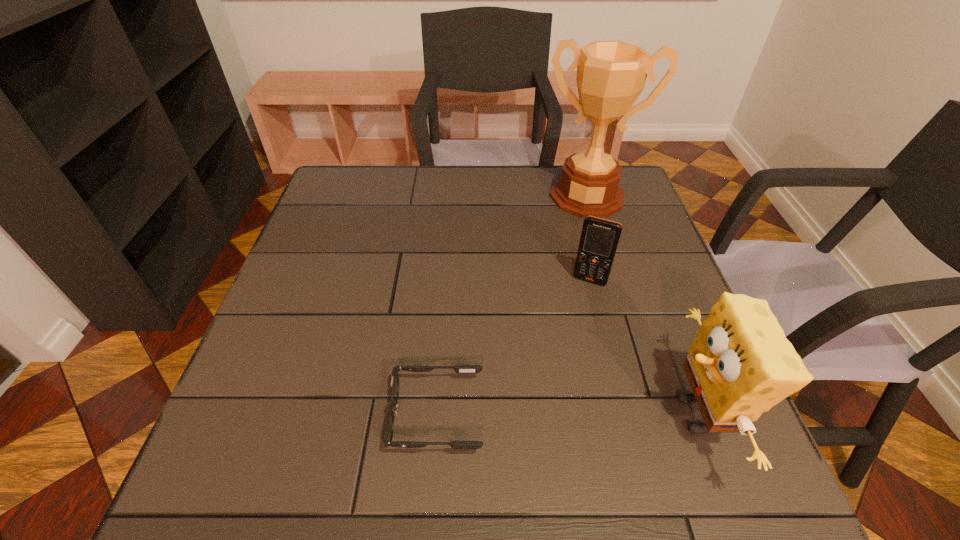
Image resolution: width=960 pixels, height=540 pixels. Find the location of `sunglasses present at the near edge`. sunglasses present at the near edge is located at coordinates (458, 445).

Identify the location of sponge that is at the near edge. (740, 364).

This screenshot has width=960, height=540. I want to click on sponge at the right edge, so click(x=740, y=364).

What are the coordinates of `award present at the right edge` in the screenshot? It's located at (611, 75).

The width and height of the screenshot is (960, 540). I want to click on object present at the far right corner, so click(611, 75).

At what (x,y) coordinates should I click in order to perform the action: click on object that is positioned at the near right corner. Please return your answer as a coordinate pair (x, y). The height and width of the screenshot is (540, 960). Looking at the image, I should click on (740, 364).

The width and height of the screenshot is (960, 540). Find the location of `vacant position at the far edge of the desktop`. vacant position at the far edge of the desktop is located at coordinates (458, 181).

Where is `vacant space at the near edge`? This screenshot has height=540, width=960. vacant space at the near edge is located at coordinates (606, 400).

Find the location of a particular element. free point at the left edge is located at coordinates (329, 340).

The height and width of the screenshot is (540, 960). I want to click on free space at the right edge, so click(615, 305).